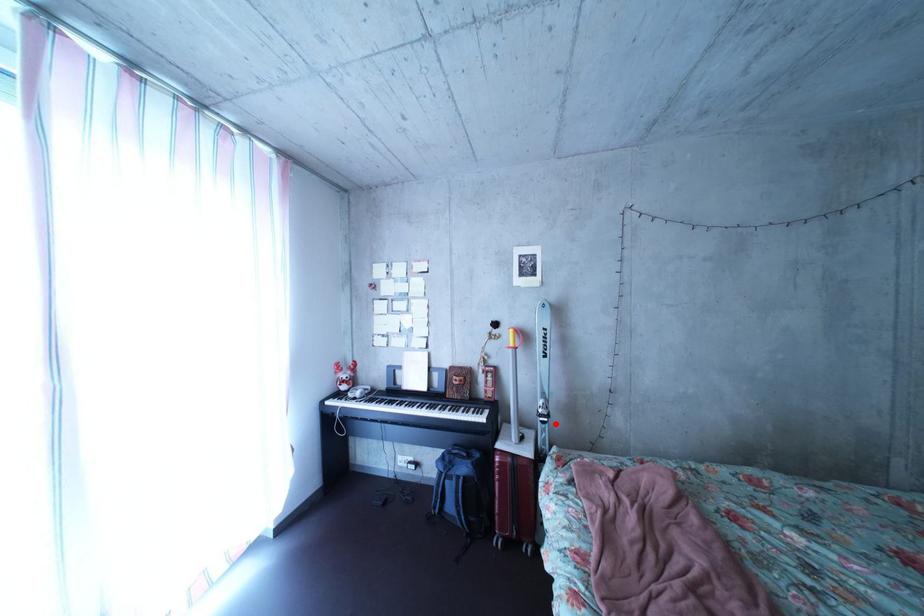
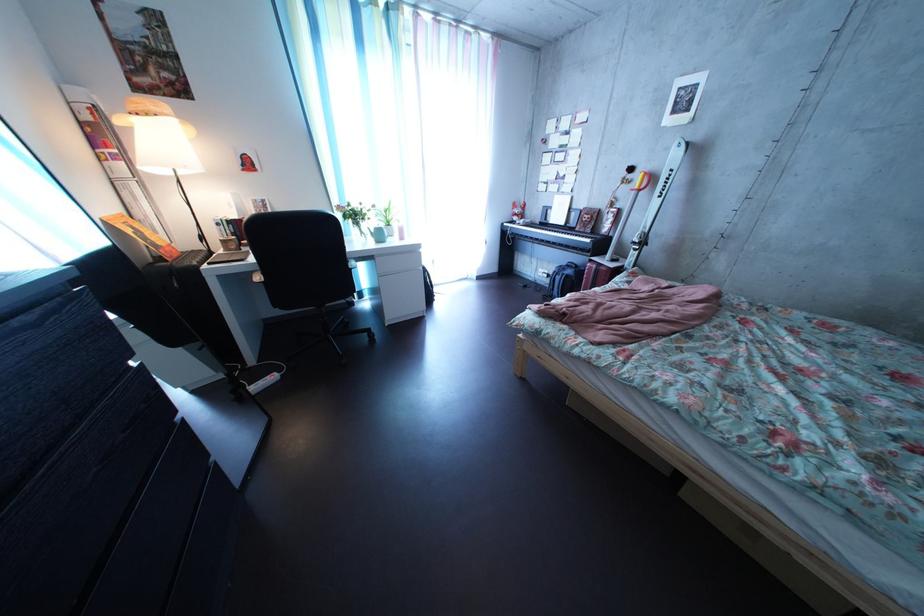
Question: I am providing you with two images of the same scene from different viewpoints. In image1, a red point is highlighted. Considering the same 3D point in image2, which of the following is correct?

Choices:
 (A) It is closer
 (B) It is farther

Answer: (A)